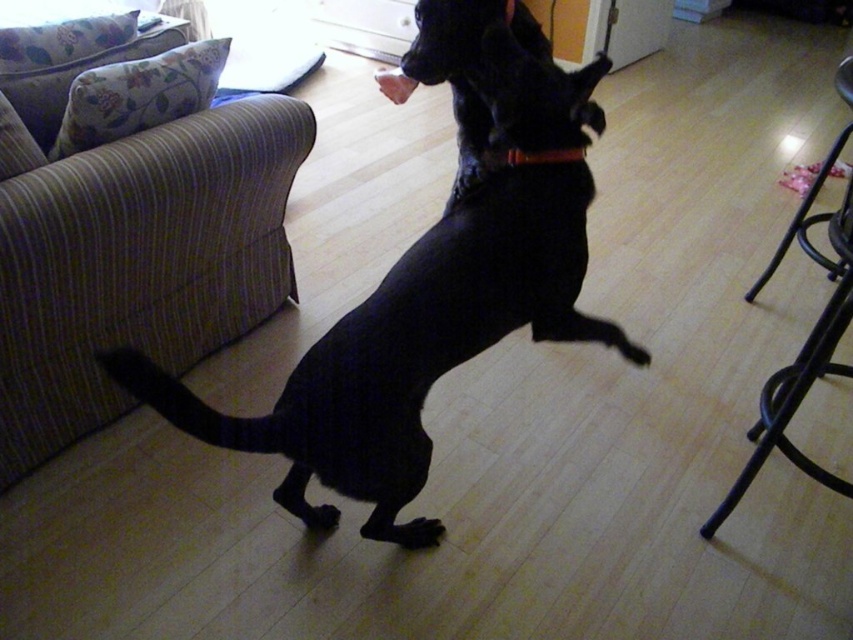
You are standing in the living room and see two points marked on the floor. The first point is at coordinate point (490, 168) and the second point is at coordinate point (514, 163). Which point is closer to the black dog that is jumping with its back legs on the floor?

Point (514, 163) is closer to the black dog that is jumping with its back legs on the floor because it is in front of point (490, 168) according to the spatial description.

You are a dog owner trying to locate your dog in the living room. You see the striped fabric couch at left and the black matte paw at lower center. Which object is positioned higher in the image?

The striped fabric couch at left is positioned higher in the image than the black matte paw at lower center.